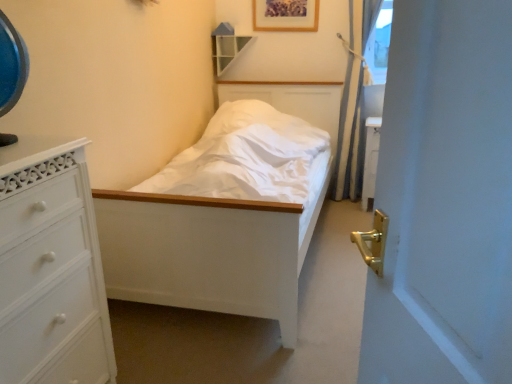
Question: From the image's perspective, does white painted wood chest of drawers at left appear lower than wooden shelf at upper center?

Choices:
 (A) yes
 (B) no

Answer: (A)

Question: Does white painted wood chest of drawers at left have a greater height compared to wooden shelf at upper center?

Choices:
 (A) yes
 (B) no

Answer: (A)

Question: Can you confirm if white painted wood chest of drawers at left is wider than wooden shelf at upper center?

Choices:
 (A) yes
 (B) no

Answer: (A)

Question: Is white painted wood chest of drawers at left next to wooden shelf at upper center?

Choices:
 (A) no
 (B) yes

Answer: (A)

Question: Is wooden shelf at upper center surrounded by white painted wood chest of drawers at left?

Choices:
 (A) no
 (B) yes

Answer: (A)

Question: Is the position of white painted wood chest of drawers at left less distant than that of wooden shelf at upper center?

Choices:
 (A) no
 (B) yes

Answer: (B)

Question: From the image's perspective, does wooden picture frame at upper center appear higher than white painted wood bed at center?

Choices:
 (A) no
 (B) yes

Answer: (B)

Question: Is wooden picture frame at upper center to the right of white painted wood bed at center from the viewer's perspective?

Choices:
 (A) no
 (B) yes

Answer: (B)

Question: Is wooden picture frame at upper center in contact with white painted wood bed at center?

Choices:
 (A) yes
 (B) no

Answer: (B)

Question: Is wooden picture frame at upper center closer to camera compared to white painted wood bed at center?

Choices:
 (A) yes
 (B) no

Answer: (B)

Question: Is wooden picture frame at upper center positioned with its back to white painted wood bed at center?

Choices:
 (A) no
 (B) yes

Answer: (A)

Question: Is wooden picture frame at upper center shorter than white painted wood bed at center?

Choices:
 (A) yes
 (B) no

Answer: (A)

Question: Is wooden shelf at upper center oriented towards white painted wood chest of drawers at left?

Choices:
 (A) yes
 (B) no

Answer: (A)